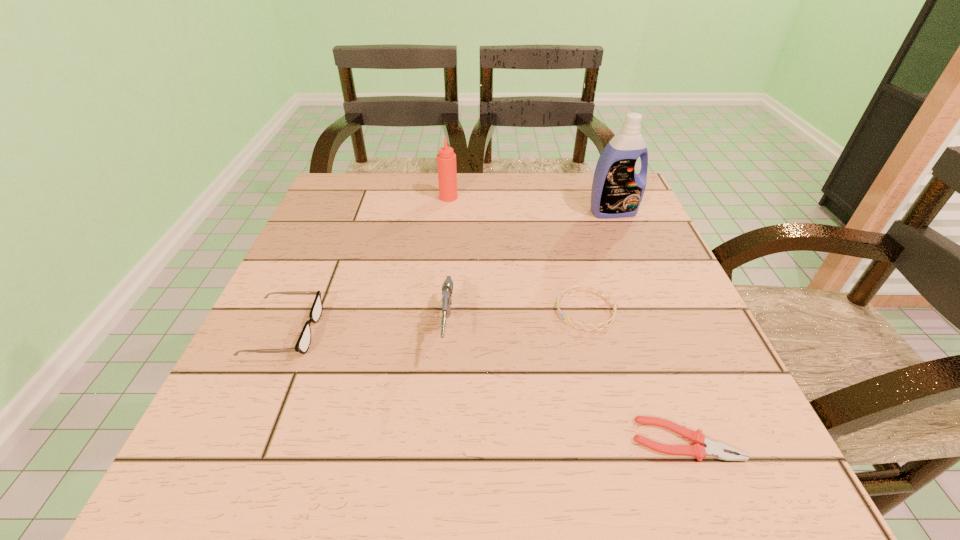
Identify the location of free spot located on the left of the fifth nearest object. (560, 212).

Find the location of `blank space located 0.290m on the left of the Tabasco sauce`. blank space located 0.290m on the left of the Tabasco sauce is located at coordinates (328, 198).

Find the location of `free space located 0.210m at the barrel of the gun`. free space located 0.210m at the barrel of the gun is located at coordinates (x=435, y=502).

Find the location of a particular element. The height and width of the screenshot is (540, 960). vacant area located 0.110m on the front-facing side of the spectacles is located at coordinates (377, 332).

Find the location of a particular element. vacant area located on the surface of the bracelet showing star-shaped elements is located at coordinates (510, 310).

I want to click on vacant region located on the surface of the bracelet showing star-shaped elements, so click(373, 310).

Locate an element on the screen. This screenshot has height=540, width=960. blank area located 0.160m on the surface of the bracelet showing star-shaped elements is located at coordinates [x=473, y=310].

Identify the location of vacant area located 0.400m on the back of the shortest object. This screenshot has width=960, height=540. (615, 255).

This screenshot has width=960, height=540. I want to click on detergent situated at the far edge, so click(x=617, y=191).

This screenshot has width=960, height=540. Find the location of `Tabasco sauce at the far edge`. Tabasco sauce at the far edge is located at coordinates (446, 159).